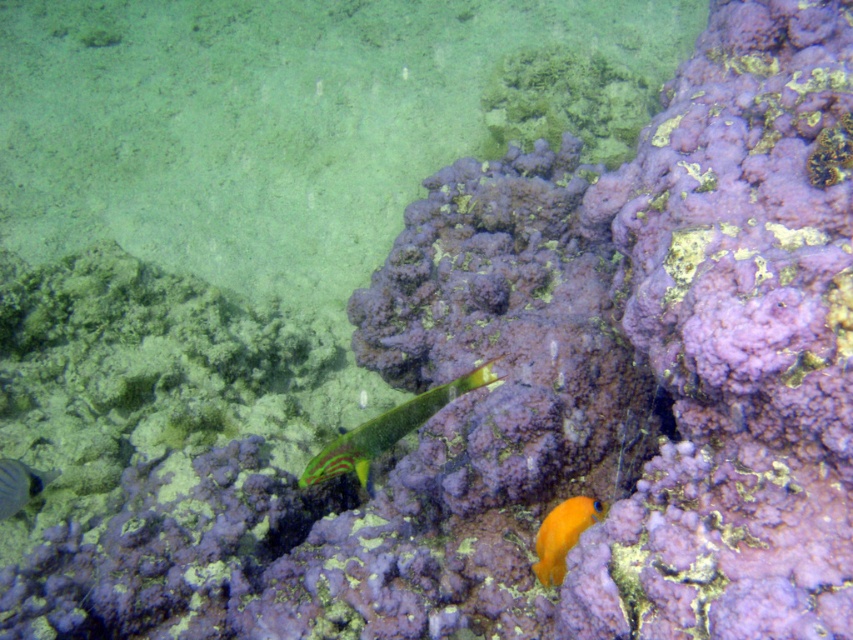
Question: Is green glossy fish at center bigger than orange matte fish at lower right?

Choices:
 (A) no
 (B) yes

Answer: (B)

Question: Can you confirm if green glossy fish at center is smaller than orange matte fish at lower right?

Choices:
 (A) no
 (B) yes

Answer: (A)

Question: Does green glossy fish at center appear on the right side of orange matte fish at lower right?

Choices:
 (A) no
 (B) yes

Answer: (A)

Question: Among these objects, which one is farthest from the camera?

Choices:
 (A) shiny silver fish at lower left
 (B) green glossy fish at center

Answer: (A)

Question: Which point appears closest to the camera in this image?

Choices:
 (A) (541, 529)
 (B) (1, 516)

Answer: (A)

Question: Which point is farther to the camera?

Choices:
 (A) (4, 467)
 (B) (546, 531)
 (C) (363, 486)

Answer: (C)